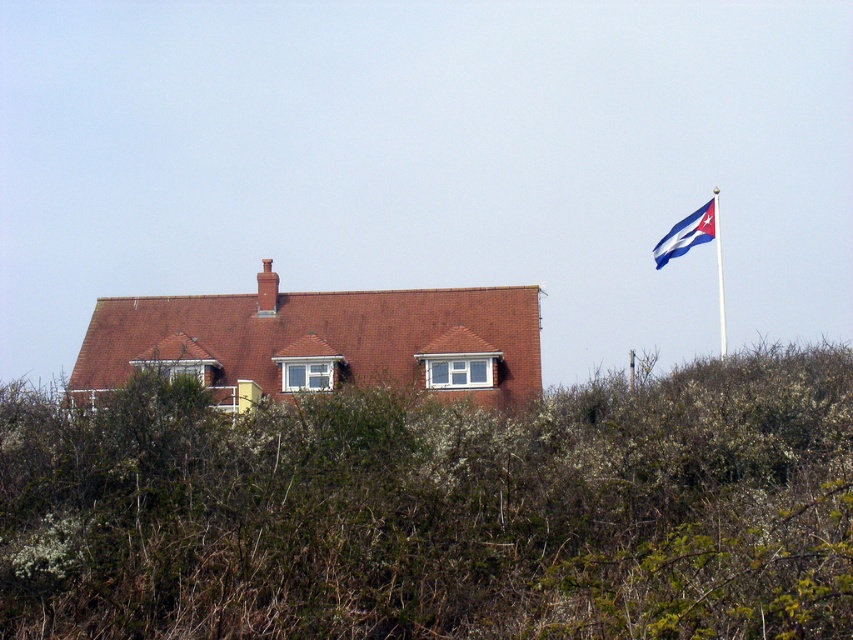
Can you confirm if blue fabric flag at upper right is smaller than white plastic flag pole at upper right?

Yes, blue fabric flag at upper right is smaller than white plastic flag pole at upper right.

Can you confirm if blue fabric flag at upper right is wider than white plastic flag pole at upper right?

In fact, blue fabric flag at upper right might be narrower than white plastic flag pole at upper right.

Is point (686, 220) positioned behind point (720, 305)?

No, (686, 220) is closer to viewer.

Where is `blue fabric flag at upper right`? blue fabric flag at upper right is located at coordinates (686, 234).